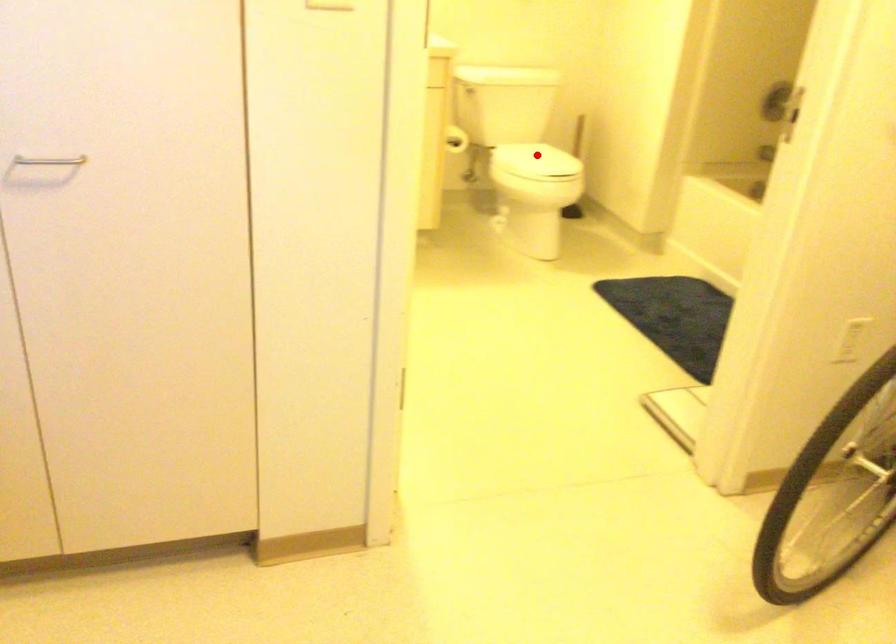
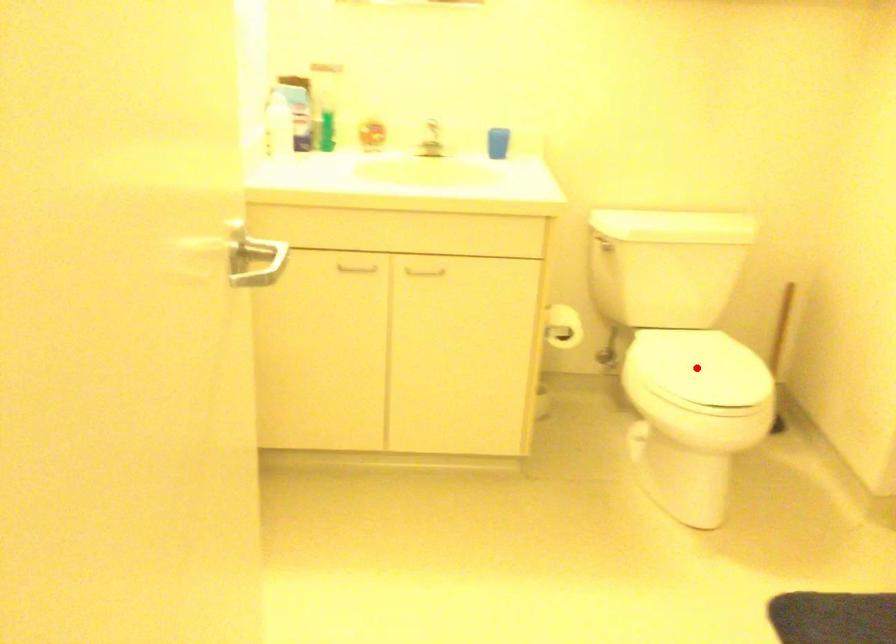
From the picture: I am providing you with two images of the same scene from different viewpoints. A red point is marked on the first image and another point is marked on the second image. Is the marked point in image1 the same physical position as the marked point in image2?

Yes